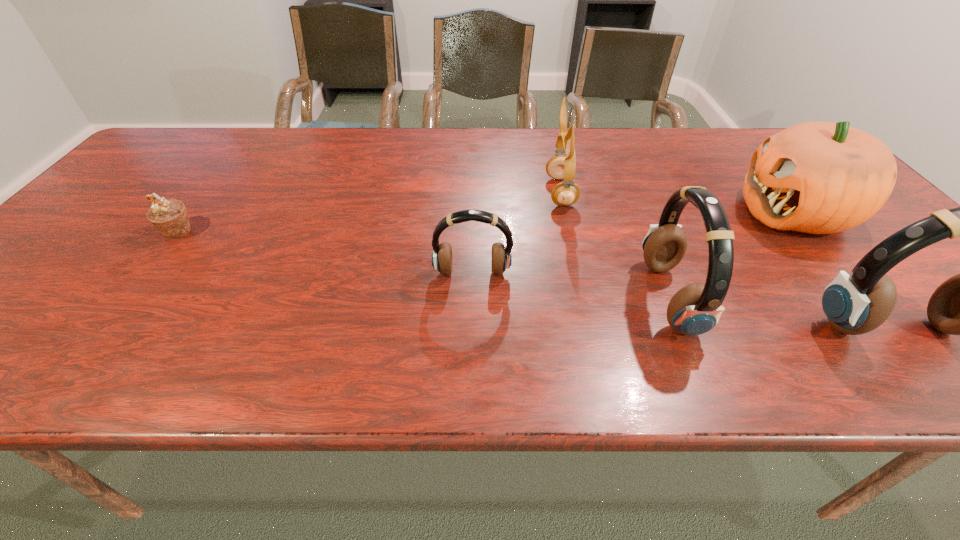
Locate which object is the second closest to the fourth object from left to right. Please provide its 2D coordinates. Your answer should be formatted as a tuple, i.e. [(x, y)], where the tuple contains the x and y coordinates of a point satisfying the conditions above.

[(854, 304)]

Select which object is the closest to the muffin. Please provide its 2D coordinates. Your answer should be formatted as a tuple, i.e. [(x, y)], where the tuple contains the x and y coordinates of a point satisfying the conditions above.

[(501, 259)]

Identify the location of headset identified as the closest to the fifth tallest object. The image size is (960, 540). (695, 309).

Where is `headset that is the third closest to the shortest object`? This screenshot has height=540, width=960. headset that is the third closest to the shortest object is located at coordinates (854, 304).

Identify the location of free space that satisfies the following two spatial constraints: 1. on the face of the pumpkin; 2. on the ear cup of the second object from left to right. (846, 273).